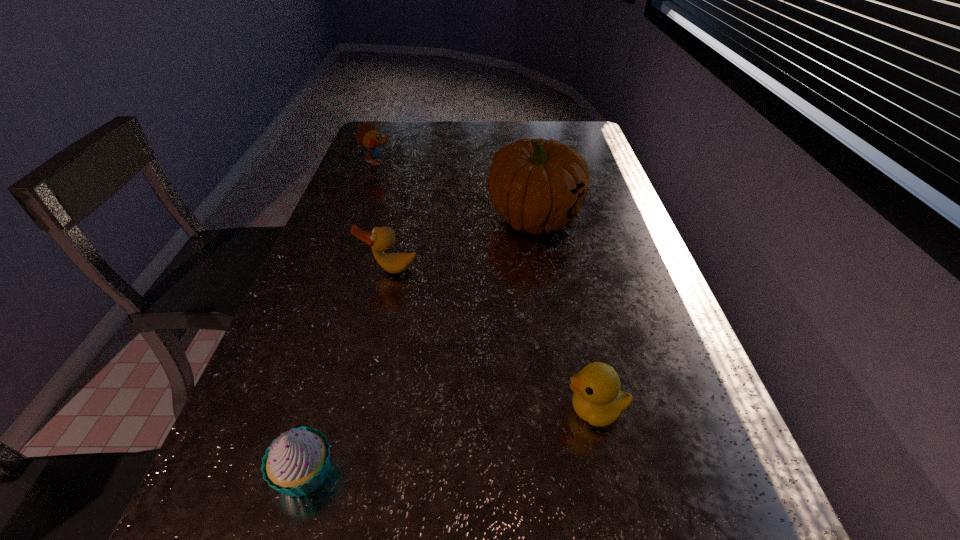
At what (x,y) coordinates should I click in order to perform the action: click on free location located on the front-facing side of the leftmost duck. Please return your answer as a coordinate pair (x, y). The image size is (960, 540). Looking at the image, I should click on (503, 163).

Where is `vacant area situated 0.100m on the beak of the second farthest duck`? vacant area situated 0.100m on the beak of the second farthest duck is located at coordinates (380, 308).

I want to click on vacant space located 0.080m on the face of the fourth farthest object, so click(x=518, y=410).

You are a GUI agent. You are given a task and a screenshot of the screen. Output one action in this format:
    pyautogui.click(x=<x>, y=<y>)
    Task: Click on the vacant space located on the face of the fourth farthest object
    The height and width of the screenshot is (540, 960).
    Given the screenshot: What is the action you would take?
    pyautogui.click(x=463, y=410)

The width and height of the screenshot is (960, 540). Identify the location of vacant region located on the face of the fourth farthest object. (363, 410).

The height and width of the screenshot is (540, 960). Find the location of `free location located on the right of the nearest object`. free location located on the right of the nearest object is located at coordinates (560, 472).

Where is `cupcake that is at the left edge`? Image resolution: width=960 pixels, height=540 pixels. cupcake that is at the left edge is located at coordinates (296, 463).

The height and width of the screenshot is (540, 960). Find the location of `pumpkin at the right edge`. pumpkin at the right edge is located at coordinates (537, 185).

The width and height of the screenshot is (960, 540). Identify the location of duck that is at the right edge. (597, 399).

Locate an element on the screen. free spot at the far edge of the desktop is located at coordinates (466, 121).